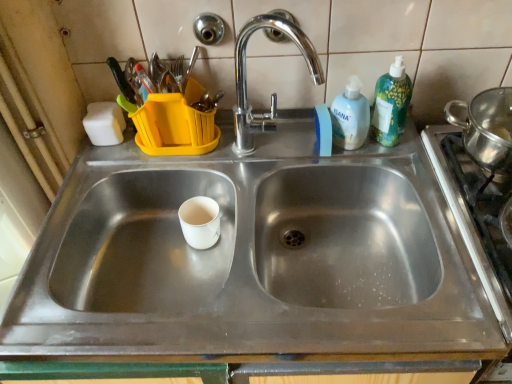
Where is `free space underneath polished chrome faucet at upper center (from a real-world perspective)`? free space underneath polished chrome faucet at upper center (from a real-world perspective) is located at coordinates (263, 168).